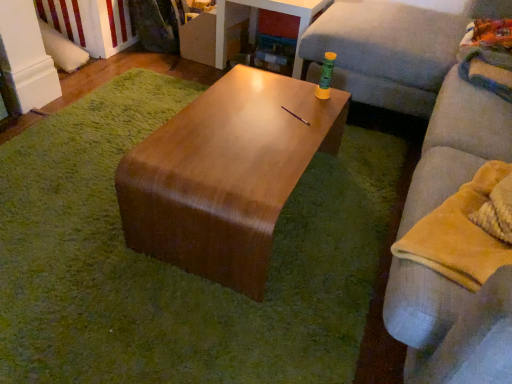
Question: Considering the relative positions of wooden table at center and light gray fabric couch at right in the image provided, is wooden table at center to the left of light gray fabric couch at right from the viewer's perspective?

Choices:
 (A) yes
 (B) no

Answer: (A)

Question: Is wooden table at center further to camera compared to light gray fabric couch at right?

Choices:
 (A) yes
 (B) no

Answer: (A)

Question: Is wooden table at center completely or partially outside of light gray fabric couch at right?

Choices:
 (A) no
 (B) yes

Answer: (B)

Question: From a real-world perspective, does wooden table at center stand above light gray fabric couch at right?

Choices:
 (A) yes
 (B) no

Answer: (B)

Question: Is wooden table at center oriented away from light gray fabric couch at right?

Choices:
 (A) no
 (B) yes

Answer: (A)

Question: Looking at the image, does shiny brown coffee table at center seem bigger or smaller compared to light gray fabric couch at right?

Choices:
 (A) big
 (B) small

Answer: (B)

Question: Relative to light gray fabric couch at right, is shiny brown coffee table at center in front or behind?

Choices:
 (A) front
 (B) behind

Answer: (B)

Question: From a real-world perspective, is shiny brown coffee table at center positioned above or below light gray fabric couch at right?

Choices:
 (A) above
 (B) below

Answer: (B)

Question: From their relative heights in the image, would you say shiny brown coffee table at center is taller or shorter than light gray fabric couch at right?

Choices:
 (A) tall
 (B) short

Answer: (B)

Question: From a real-world perspective, is light gray fabric couch at right above or below wooden table at center?

Choices:
 (A) above
 (B) below

Answer: (A)

Question: From the image's perspective, relative to wooden table at center, is light gray fabric couch at right above or below?

Choices:
 (A) below
 (B) above

Answer: (B)

Question: Based on their positions, is light gray fabric couch at right located to the left or right of wooden table at center?

Choices:
 (A) left
 (B) right

Answer: (B)

Question: Looking at their shapes, would you say light gray fabric couch at right is wider or thinner than wooden table at center?

Choices:
 (A) thin
 (B) wide

Answer: (A)

Question: Is light gray fabric couch at right bigger or smaller than yellow fleece blanket at right?

Choices:
 (A) small
 (B) big

Answer: (B)

Question: Is light gray fabric couch at right situated inside yellow fleece blanket at right or outside?

Choices:
 (A) inside
 (B) outside

Answer: (B)